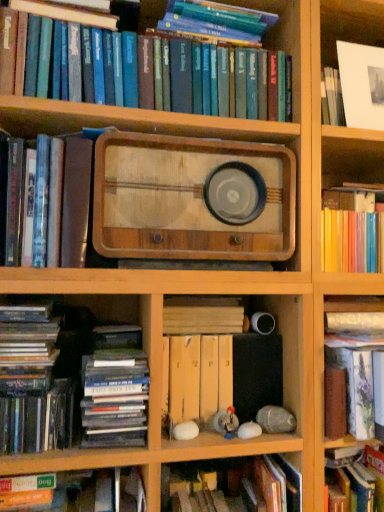
Locate an element on the screen. white matte egg at lower center, the 1th book positioned from the bottom is located at coordinates (232, 485).

Where is `white paper at upper right`? The image size is (384, 512). white paper at upper right is located at coordinates (350, 24).

At what (x,y) coordinates should I click in order to perform the action: click on hardcover book at left, placed as the 2th book when sorted from top to bottom. Please return your answer as a coordinate pair (x, y). This screenshot has width=384, height=512. Looking at the image, I should click on (63, 201).

Measure the distance between hardcover book at left, arranged as the 7th book when viewed from the top, and camera.

The distance of hardcover book at left, arranged as the 7th book when viewed from the top, from camera is 37.22 inches.

What is the approximate width of hardcover book at left, the 3th book from the bottom?

The width of hardcover book at left, the 3th book from the bottom, is 14.60 inches.

The image size is (384, 512). Find the location of `matte black cd at lower left, arranged as the 5th book when ordered from the bottom`. matte black cd at lower left, arranged as the 5th book when ordered from the bottom is located at coordinates (115, 398).

Image resolution: width=384 pixels, height=512 pixels. Describe the element at coordinates (201, 89) in the screenshot. I see `hardcover books at upper center, placed as the ninth book when sorted from bottom to top` at that location.

Identify the location of hardcover books at upper center, which is the first book in top-to-bottom order. This screenshot has width=384, height=512. (201, 89).

In order to click on yellow cardboard file at center, the fourth book when ordered from bottom to top in this screenshot , I will do `click(198, 355)`.

At what (x,y) coordinates should I click in order to perform the action: click on white matte egg at lower center, marked as the ninth book in a top-to-bottom arrangement. Please return your answer as a coordinate pair (x, y). Looking at the image, I should click on (232, 485).

Who is taller, wooden plank at center, which is the third book in top-to-bottom order, or hardcover book at lower left, acting as the second book starting from the bottom?

hardcover book at lower left, acting as the second book starting from the bottom.

From a real-world perspective, which object rests below the other?

hardcover book at lower left, acting as the second book starting from the bottom, is physically lower.

Which point is more forward, (178, 304) or (26, 484)?

Point (26, 484)

Based on the photo, is wooden plank at center, which is the third book in top-to-bottom order, not within white paper at upper right?

Absolutely, wooden plank at center, which is the third book in top-to-bottom order, is external to white paper at upper right.

Is wooden plank at center, which is the third book in top-to-bottom order, positioned with its back to white paper at upper right?

wooden plank at center, which is the third book in top-to-bottom order, is not turned away from white paper at upper right.

Which of these two, wooden plank at center, which is the seventh book in bottom-to-top order, or white paper at upper right, is wider?

With larger width is wooden plank at center, which is the seventh book in bottom-to-top order.

From a real-world perspective, who is located lower, wooden plank at center, which is the third book in top-to-bottom order, or white paper at upper right?

wooden plank at center, which is the third book in top-to-bottom order, is physically lower.

Does wooden plank at center, which is the seventh book in bottom-to-top order, have a greater height compared to matte black book at lower left, which is the 4th book from top to bottom?

Incorrect, the height of wooden plank at center, which is the seventh book in bottom-to-top order, is not larger of that of matte black book at lower left, which is the 4th book from top to bottom.

Is wooden plank at center, which is the third book in top-to-bottom order, wider or thinner than matte black book at lower left, which appears as the 6th book when ordered from the bottom?

wooden plank at center, which is the third book in top-to-bottom order, is thinner than matte black book at lower left, which appears as the 6th book when ordered from the bottom.

Which is in front, point (177, 332) or point (57, 429)?

Point (57, 429)

What's the angular difference between wooden plank at center, which is the third book in top-to-bottom order, and matte black book at lower left, which is the 4th book from top to bottom,'s facing directions?

They differ by 0.00038 degrees in their facing directions.

From a real-world perspective, is matte black book at lower left, which is the 4th book from top to bottom, under hardcover book at left, placed as the 2th book when sorted from top to bottom?

Indeed, from a real-world perspective, matte black book at lower left, which is the 4th book from top to bottom, is positioned beneath hardcover book at left, placed as the 2th book when sorted from top to bottom.

From their relative heights in the image, would you say matte black book at lower left, which is the 4th book from top to bottom, is taller or shorter than hardcover book at left, positioned as the eighth book in bottom-to-top order?

Considering their sizes, matte black book at lower left, which is the 4th book from top to bottom, has less height than hardcover book at left, positioned as the eighth book in bottom-to-top order.

Which is in front, point (70, 436) or point (57, 150)?

Point (57, 150)

Is matte black book at lower left, which is the 4th book from top to bottom, in contact with hardcover book at left, positioned as the eighth book in bottom-to-top order?

No, matte black book at lower left, which is the 4th book from top to bottom, is not making contact with hardcover book at left, positioned as the eighth book in bottom-to-top order.

Is hardcover book at left, arranged as the 7th book when viewed from the top, facing away from white matte egg at lower center, marked as the ninth book in a top-to-bottom arrangement?

hardcover book at left, arranged as the 7th book when viewed from the top, does not have its back to white matte egg at lower center, marked as the ninth book in a top-to-bottom arrangement.

How much distance is there between hardcover book at left, the 3th book from the bottom, and white matte egg at lower center, marked as the ninth book in a top-to-bottom arrangement?

hardcover book at left, the 3th book from the bottom, and white matte egg at lower center, marked as the ninth book in a top-to-bottom arrangement, are 45.56 centimeters apart.

From the image's perspective, would you say hardcover book at left, the 3th book from the bottom, is positioned over white matte egg at lower center, the 1th book positioned from the bottom?

Indeed, from the image's perspective, hardcover book at left, the 3th book from the bottom, is shown above white matte egg at lower center, the 1th book positioned from the bottom.

Could white matte egg at lower center, marked as the ninth book in a top-to-bottom arrangement, be considered to be inside hardcover book at left, arranged as the 7th book when viewed from the top?

No, white matte egg at lower center, marked as the ninth book in a top-to-bottom arrangement, is not inside hardcover book at left, arranged as the 7th book when viewed from the top.

Could you tell me if hardcover book at lower left, acting as the second book starting from the bottom, is facing matte black cd at lower left, arranged as the 5th book when ordered from the bottom?

No.

From a real-world perspective, is hardcover book at lower left, marked as the eighth book in a top-to-bottom arrangement, located higher than matte black cd at lower left, arranged as the 5th book when ordered from the bottom?

No, from a real-world perspective, hardcover book at lower left, marked as the eighth book in a top-to-bottom arrangement, is not on top of matte black cd at lower left, arranged as the 5th book when ordered from the bottom.

Which is correct: hardcover book at lower left, acting as the second book starting from the bottom, is inside matte black cd at lower left, arranged as the 5th book when ordered from the bottom, or outside of it?

hardcover book at lower left, acting as the second book starting from the bottom, is not inside matte black cd at lower left, arranged as the 5th book when ordered from the bottom, it's outside.

Considering the relative sizes of hardcover book at lower left, marked as the eighth book in a top-to-bottom arrangement, and matte black cd at lower left, which appears as the fifth book when viewed from the top, in the image provided, is hardcover book at lower left, marked as the eighth book in a top-to-bottom arrangement, wider than matte black cd at lower left, which appears as the fifth book when viewed from the top,?

In fact, hardcover book at lower left, marked as the eighth book in a top-to-bottom arrangement, might be narrower than matte black cd at lower left, which appears as the fifth book when viewed from the top.

Considering the sizes of objects hardcover books at upper center, which is the first book in top-to-bottom order, and wooden plank at center, which is the seventh book in bottom-to-top order, in the image provided, who is shorter, hardcover books at upper center, which is the first book in top-to-bottom order, or wooden plank at center, which is the seventh book in bottom-to-top order,?

With less height is wooden plank at center, which is the seventh book in bottom-to-top order.

Measure the distance between hardcover books at upper center, which is the first book in top-to-bottom order, and wooden plank at center, which is the third book in top-to-bottom order.

The distance of hardcover books at upper center, which is the first book in top-to-bottom order, from wooden plank at center, which is the third book in top-to-bottom order, is 22.57 inches.

Between hardcover books at upper center, which is the first book in top-to-bottom order, and wooden plank at center, which is the seventh book in bottom-to-top order, which one is positioned behind?

Positioned behind is wooden plank at center, which is the seventh book in bottom-to-top order.

Is wooden plank at center, which is the third book in top-to-bottom order, at the back of hardcover books at upper center, placed as the ninth book when sorted from bottom to top?

No, hardcover books at upper center, placed as the ninth book when sorted from bottom to top,'s orientation is not away from wooden plank at center, which is the third book in top-to-bottom order.

From a real-world perspective, which book is the 5th one above the hardcover book at lower left, acting as the second book starting from the bottom? Please provide its 2D coordinates.

[(202, 315)]

Find the location of a particular element. shelf on the right of the wooden plank at center, which is the third book in top-to-bottom order is located at coordinates (350, 24).

When comparing their distances from white matte egg at lower center, marked as the ninth book in a top-to-bottom arrangement, does hardcover books at upper center, placed as the ninth book when sorted from bottom to top, or white paper at upper right seem closer?

Based on the image, hardcover books at upper center, placed as the ninth book when sorted from bottom to top, appears to be nearer to white matte egg at lower center, marked as the ninth book in a top-to-bottom arrangement.

Considering their positions, is matte black book at lower left, which appears as the 6th book when ordered from the bottom, positioned further to hardcover book at left, the 3th book from the bottom, than matte black cd at lower left, arranged as the 5th book when ordered from the bottom?

Based on the image, matte black cd at lower left, arranged as the 5th book when ordered from the bottom, appears to be further to hardcover book at left, the 3th book from the bottom.

Looking at this image, looking at the image, which one is located further to hardcover books at upper center, which is the first book in top-to-bottom order, hardcover book at left, positioned as the eighth book in bottom-to-top order, or wooden plank at center, which is the third book in top-to-bottom order?

Among the two, wooden plank at center, which is the third book in top-to-bottom order, is located further to hardcover books at upper center, which is the first book in top-to-bottom order.

From the picture: From the image, which object appears to be farther from hardcover books at upper center, which is the first book in top-to-bottom order, yellow cardboard file at center, the fourth book when ordered from bottom to top, or wooden radio at center?

yellow cardboard file at center, the fourth book when ordered from bottom to top, lies further to hardcover books at upper center, which is the first book in top-to-bottom order, than the other object.

Which object lies further to the anchor point matte black book at lower left, which is the 4th book from top to bottom, wooden plank at center, which is the third book in top-to-bottom order, or white matte egg at lower center, the 1th book positioned from the bottom?

The object further to matte black book at lower left, which is the 4th book from top to bottom, is white matte egg at lower center, the 1th book positioned from the bottom.

From the image, which object appears to be farther from hardcover book at lower left, acting as the second book starting from the bottom, white paper at upper right or hardcover book at left, the 3th book from the bottom?

white paper at upper right is positioned further to the anchor hardcover book at lower left, acting as the second book starting from the bottom.

Estimate the real-world distances between objects in this image. Which object is closer to hardcover book at lower left, acting as the second book starting from the bottom, yellow cardboard file at center, which is the 6th book in top-to-bottom order, or hardcover book at left, placed as the 2th book when sorted from top to bottom?

yellow cardboard file at center, which is the 6th book in top-to-bottom order.

Looking at the image, which one is located further to wooden radio at center, matte black cd at lower left, which appears as the fifth book when viewed from the top, or wooden plank at center, which is the third book in top-to-bottom order?

matte black cd at lower left, which appears as the fifth book when viewed from the top.

Image resolution: width=384 pixels, height=512 pixels. Find the location of `paperback book between hardcover books at upper center, placed as the ninth book when sorted from bottom to top, and matte black book at lower left, which is the 4th book from top to bottom, from top to bottom`. paperback book between hardcover books at upper center, placed as the ninth book when sorted from bottom to top, and matte black book at lower left, which is the 4th book from top to bottom, from top to bottom is located at coordinates (187, 199).

Locate an element on the screen. paperback book that lies between white paper at upper right and wooden plank at center, which is the third book in top-to-bottom order, from top to bottom is located at coordinates (187, 199).

Where is `paperback book between white paper at upper right and white matte egg at lower center, marked as the ninth book in a top-to-bottom arrangement, vertically`? The image size is (384, 512). paperback book between white paper at upper right and white matte egg at lower center, marked as the ninth book in a top-to-bottom arrangement, vertically is located at coordinates (187, 199).

You are a GUI agent. You are given a task and a screenshot of the screen. Output one action in this format:
    pyautogui.click(x=<x>, y=<y>)
    Task: Click on the paperback book between hardcover books at upper center, which is the first book in top-to-bottom order, and white paper at upper right from left to right
    
    Given the screenshot: What is the action you would take?
    pyautogui.click(x=187, y=199)